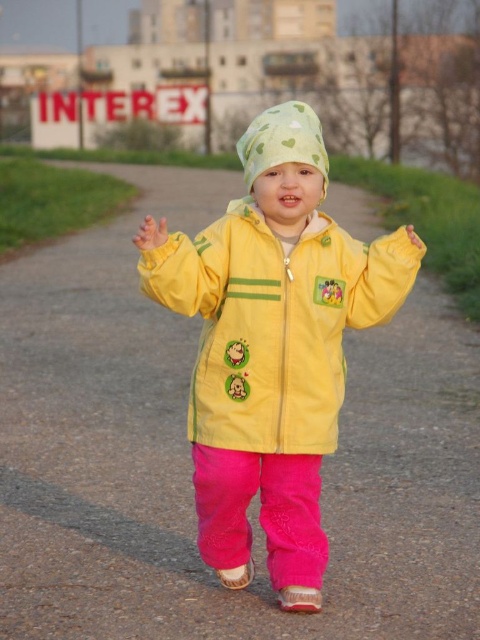
Question: Is the position of yellow matte jacket at center less distant than that of green fabric hat at center?

Choices:
 (A) no
 (B) yes

Answer: (B)

Question: Among these points, which one is farthest from the camera?

Choices:
 (A) (312, 150)
 (B) (266, 378)

Answer: (B)

Question: Is yellow matte jacket at center below green fabric hat at center?

Choices:
 (A) no
 (B) yes

Answer: (B)

Question: Can you confirm if yellow matte jacket at center is wider than green fabric hat at center?

Choices:
 (A) no
 (B) yes

Answer: (B)